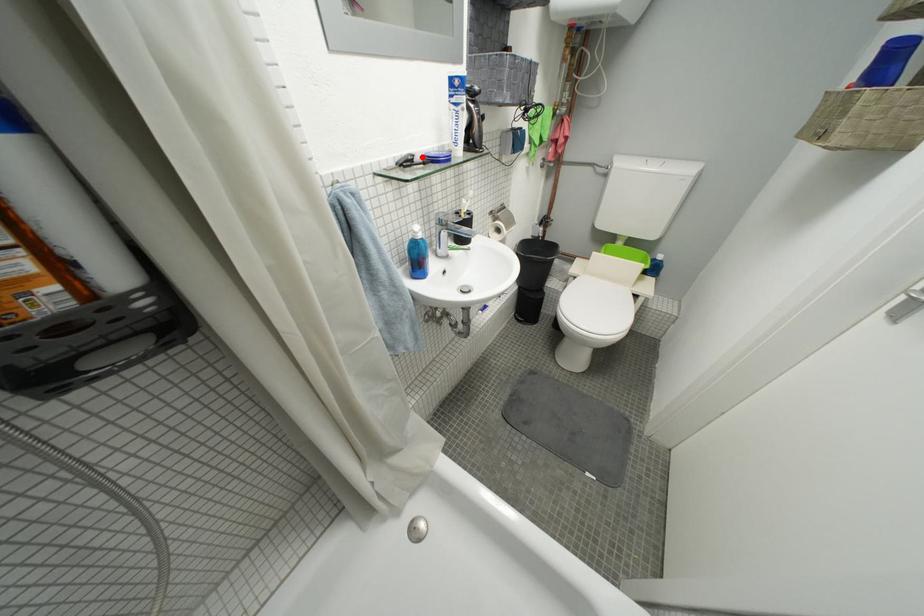
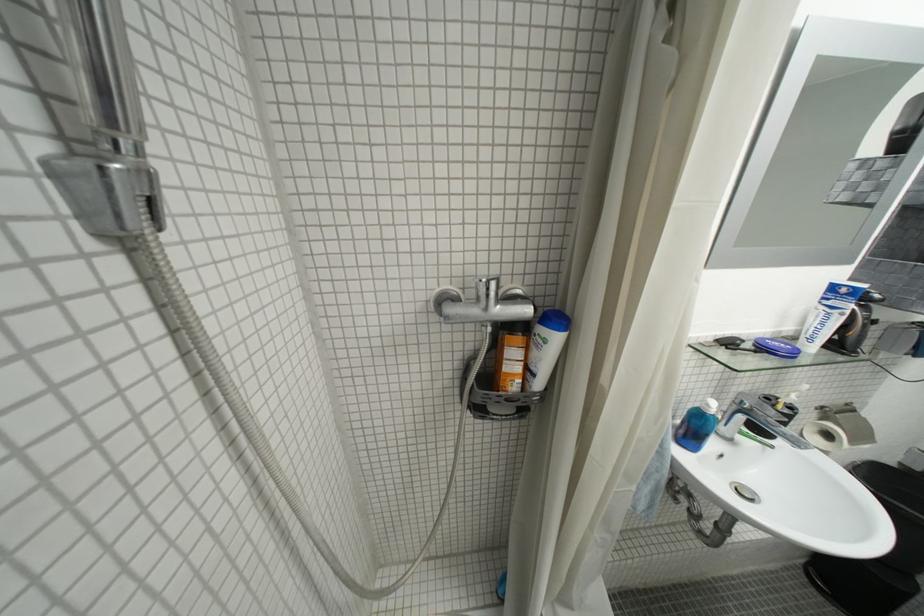
Locate, in the second image, the point that corresponds to the highlighted location in the first image.

(751, 342)